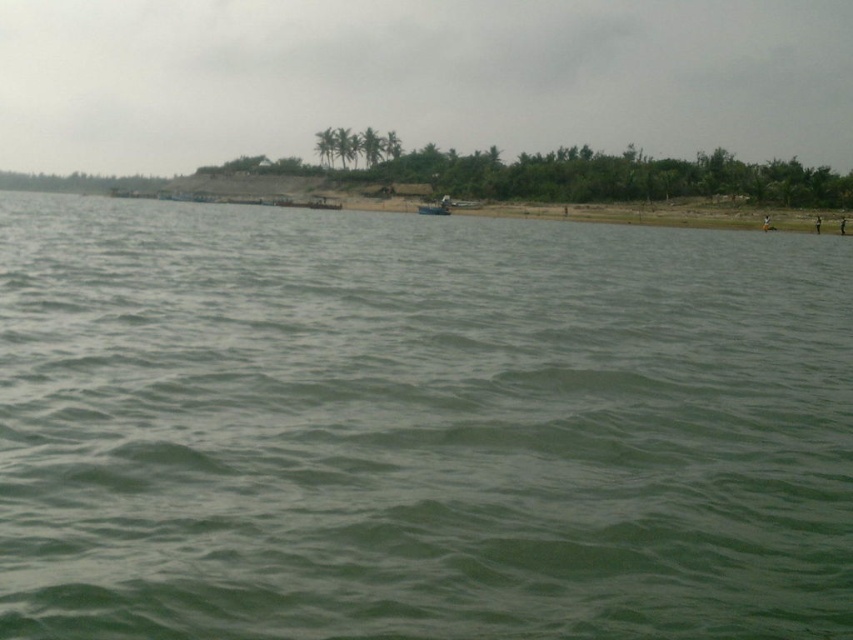
Between green grassy hill at upper center and metallic gray boat at center, which one appears on the right side from the viewer's perspective?

Positioned to the right is metallic gray boat at center.

In the scene shown: Who is more forward, (288, 36) or (434, 204)?

Point (434, 204)

Who is more distant from viewer, [489,44] or [434,202]?

Positioned behind is point [489,44].

Image resolution: width=853 pixels, height=640 pixels. Identify the location of green grassy hill at upper center. (x=418, y=77).

Locate an element on the screen. The height and width of the screenshot is (640, 853). green water at center is located at coordinates (416, 426).

Is point (433, 417) positioned after point (844, 51)?

No, (433, 417) is in front of (844, 51).

Find the location of a particular element. green water at center is located at coordinates (416, 426).

Is green water at center wider than metallic gray boat at center?

Yes.

Who is positioned more to the left, green water at center or metallic gray boat at center?

Positioned to the left is green water at center.

Is point (619, 451) more distant than point (421, 211)?

That is False.

The width and height of the screenshot is (853, 640). Find the location of `green water at center`. green water at center is located at coordinates (416, 426).